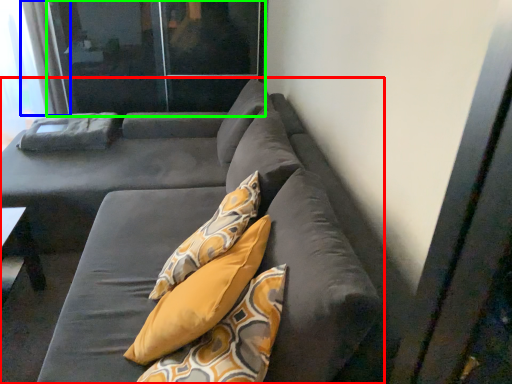
Question: Which is farther away from studio couch (highlighted by a red box)? curtain (highlighted by a blue box) or screen door (highlighted by a green box)?

Choices:
 (A) curtain
 (B) screen door

Answer: (A)